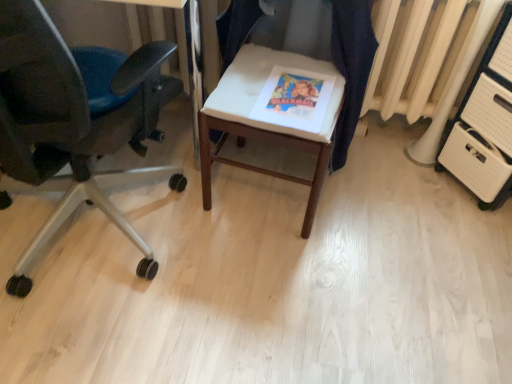
Question: From the image's perspective, is matte paper magazine at center above or below white fabric chair at center?

Choices:
 (A) below
 (B) above

Answer: (A)

Question: In terms of height, does matte paper magazine at center look taller or shorter compared to white fabric chair at center?

Choices:
 (A) short
 (B) tall

Answer: (A)

Question: Based on their relative distances, which object is farther from the white plastic file cabinet at right?

Choices:
 (A) matte paper magazine at center
 (B) matte black office chair at left, marked as the second chair in a right-to-left arrangement
 (C) white fabric chair at center
 (D) white fabric cushion at center, the first chair from the right

Answer: (B)

Question: Based on their relative distances, which object is nearer to the white plastic file cabinet at right?

Choices:
 (A) white fabric cushion at center, the first chair from the right
 (B) matte black office chair at left, the first chair viewed from the left
 (C) white fabric chair at center
 (D) matte paper magazine at center

Answer: (A)